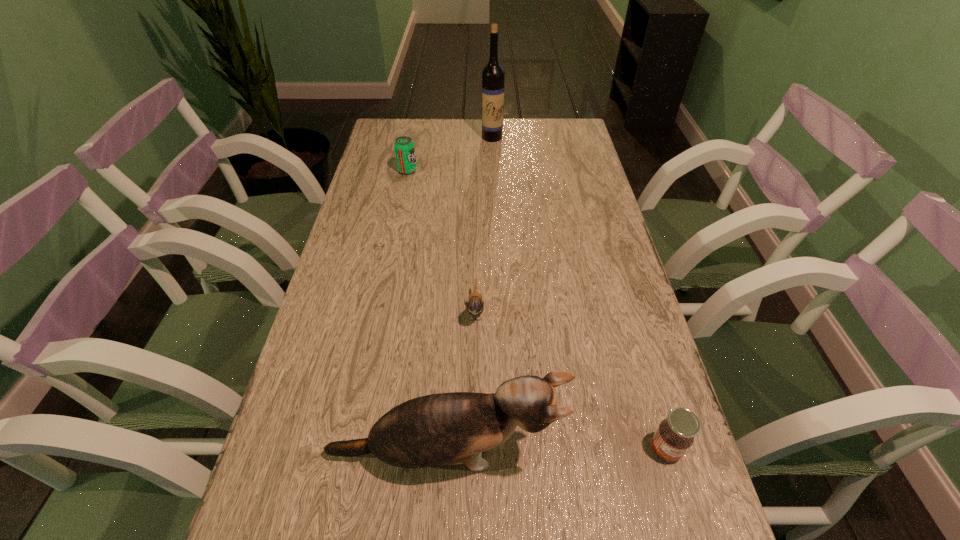
Locate an element on the screen. vacant region located 0.050m on the label side of the rightmost object is located at coordinates (680, 495).

Find the location of `vacant position located on the front-facing side of the third nearest object`. vacant position located on the front-facing side of the third nearest object is located at coordinates (474, 425).

Locate an element on the screen. This screenshot has width=960, height=540. object that is at the far edge is located at coordinates (493, 75).

The width and height of the screenshot is (960, 540). I want to click on cat at the left edge, so click(x=453, y=428).

You are a GUI agent. You are given a task and a screenshot of the screen. Output one action in this format:
    pyautogui.click(x=<x>, y=<y>)
    Task: Click on the pop soda that is at the left edge
    This screenshot has height=540, width=960.
    Given the screenshot: What is the action you would take?
    pyautogui.click(x=404, y=147)

Identify the location of object located at the right edge. (674, 436).

The image size is (960, 540). Identify the location of vacant space at the left edge of the desktop. (389, 226).

Identify the location of vacant space at the right edge of the desktop. tap(594, 339).

Find the location of a particular element. vacant space at the far left corner of the desktop is located at coordinates (377, 132).

Find the location of a particular element. This screenshot has height=540, width=960. free space at the far right corner is located at coordinates (538, 129).